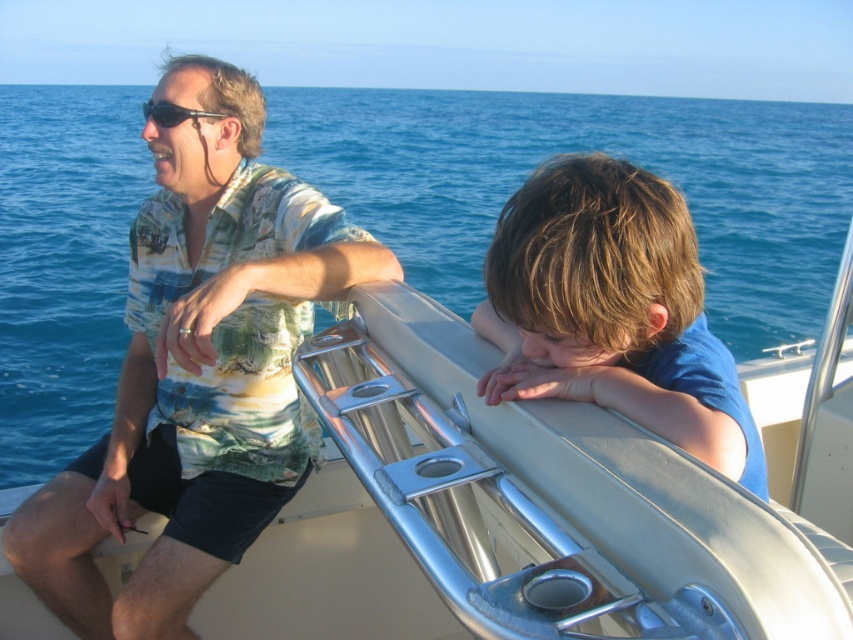
You are a photographer on the boat and want to capture both the printed fabric shirt at upper left and the blue matte shirt at right in the same frame. However, you notice that one of them is partially hidden. Which shirt is blocking the view of the other?

The printed fabric shirt at upper left is blocking the view of the blue matte shirt at right because the blue matte shirt at right is positioned behind it.

You are standing on the boat deck and want to reach both the point at coordinates point (662, 108) and the point at coordinates point (291, 292). Which point should you reach first if you want to move from the closest one to the farthest one?

You should reach point (662, 108) first because it is closer to you than point (291, 292), which is further away.

You are a photographer trying to capture the entire scene of the blue water at upper center and the printed fabric shirt at upper left in one shot. Based on their positions and sizes, do you think you can fit both into the frame without moving the camera?

The blue water at upper center might be wider than printed fabric shirt at upper left, so it is possible to fit both into the frame as long as the camera angle accommodates the width of the blue water at upper center.